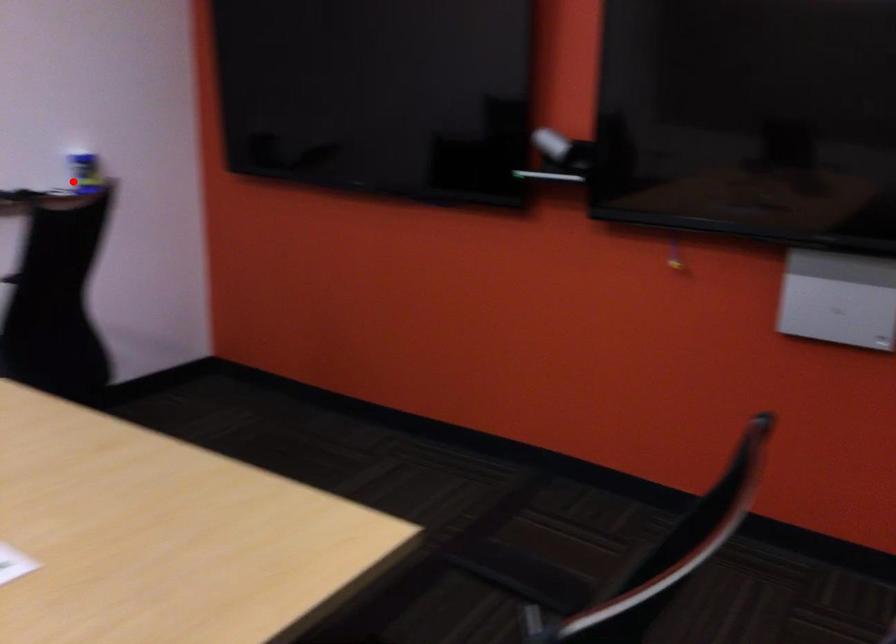
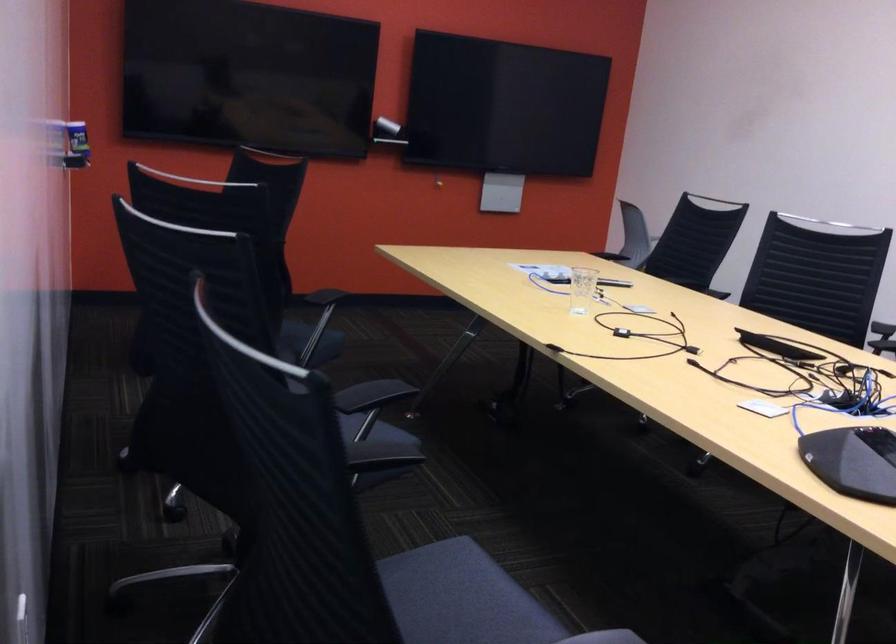
Question: I am providing you with two images of the same scene from different viewpoints. Given a red point in image1, look at the same physical point in image2. Is it:

Choices:
 (A) Closer to the viewpoint
 (B) Farther from the viewpoint

Answer: (B)